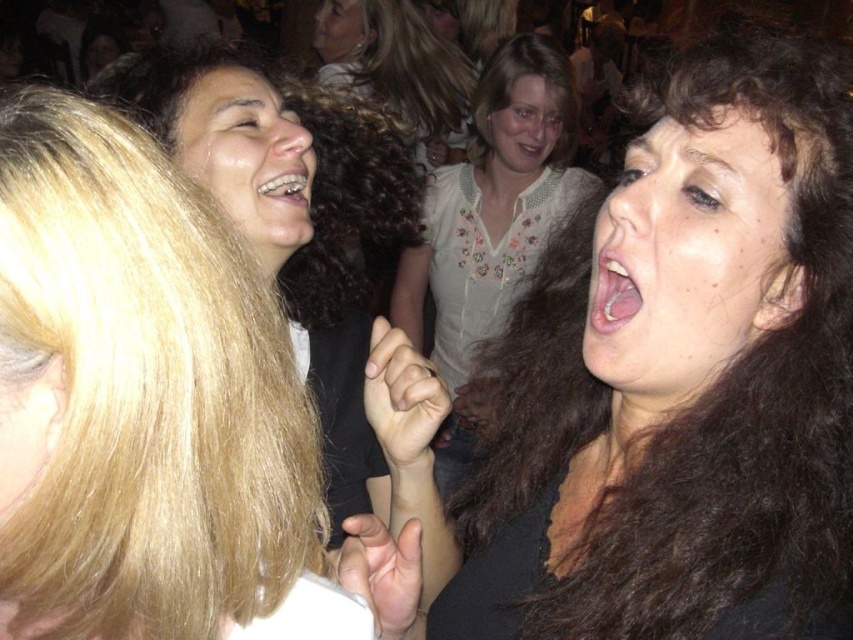
Based on the scene description, can you determine which object is taller between the smooth white blouse at center and the smooth skin face at upper center?

The smooth skin face at upper center is taller than the smooth white blouse at center according to the description.

You are at a party and want to take a photo of the smooth skin face at upper center. If your camera has a focus range of up to 3 meters, will you be able to capture it clearly?

The smooth skin face at upper center is 3.38 meters away from the viewer. Since the camera can only focus up to 3 meters, it will not be able to capture the smooth skin face at upper center clearly.